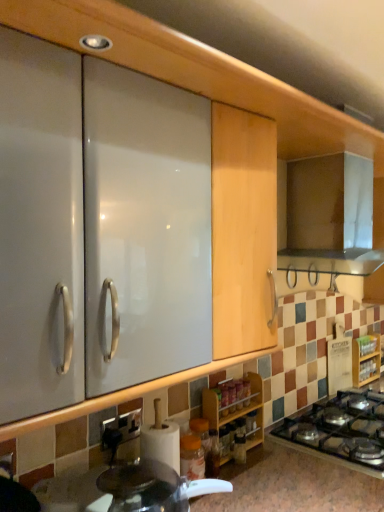
Question: From the image's perspective, is metallic silver range hood at upper right located above or below black glass gas stove at lower right?

Choices:
 (A) below
 (B) above

Answer: (B)

Question: Which is correct: metallic silver range hood at upper right is inside black glass gas stove at lower right, or outside of it?

Choices:
 (A) outside
 (B) inside

Answer: (A)

Question: Which object is positioned farthest from the metallic silver range hood at upper right?

Choices:
 (A) wooden spice rack at lower center, the first cabinetry positioned from the left
 (B) wooden spice rack at lower right, which is the 1th cabinetry in back-to-front order
 (C) white glossy countertop at lower center
 (D) black glass gas stove at lower right

Answer: (C)

Question: Which is nearer to the black glass gas stove at lower right?

Choices:
 (A) wooden spice rack at lower center, which is the second cabinetry from right to left
 (B) metallic silver range hood at upper right
 (C) white glossy countertop at lower center
 (D) wooden spice rack at lower right, which is the 2th cabinetry from front to back

Answer: (C)